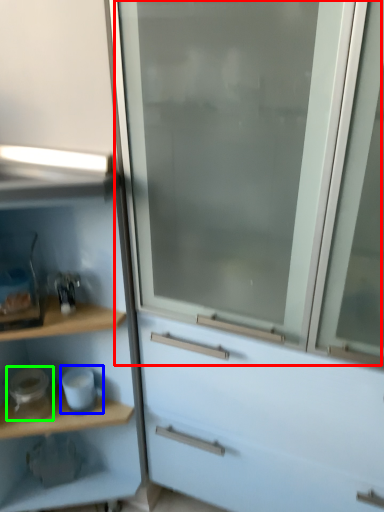
Question: Estimate the real-world distances between objects in this image. Which object is farther from screen door (highlighted by a red box), appliance (highlighted by a blue box) or appliance (highlighted by a green box)?

Choices:
 (A) appliance
 (B) appliance

Answer: (B)